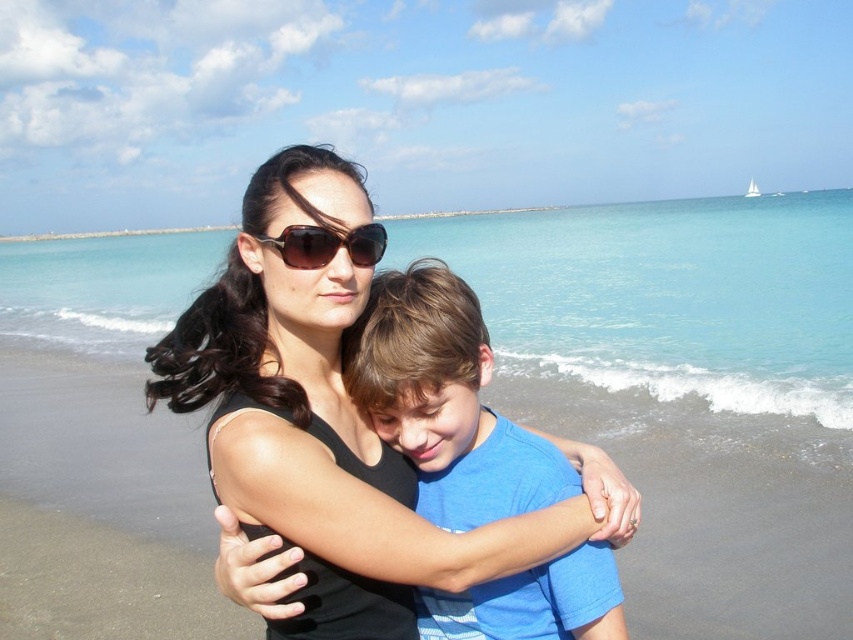
Is blue cotton shirt at center bigger than brown reflective sunglasses at center?

Yes, blue cotton shirt at center is bigger than brown reflective sunglasses at center.

Is blue cotton shirt at center wider than brown reflective sunglasses at center?

Indeed, blue cotton shirt at center has a greater width compared to brown reflective sunglasses at center.

This screenshot has width=853, height=640. I want to click on blue cotton shirt at center, so click(x=440, y=397).